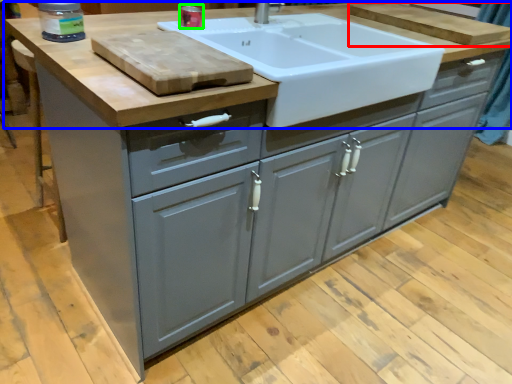
Question: Which is farther away from cutting board (highlighted by a red box)? countertop (highlighted by a blue box) or appliance (highlighted by a green box)?

Choices:
 (A) countertop
 (B) appliance

Answer: (B)